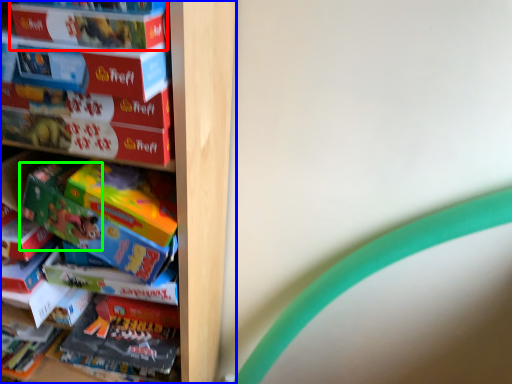
Question: Based on their relative distances, which object is nearer to paperback book (highlighted by a red box)? Choose from shelf (highlighted by a blue box) and toy (highlighted by a green box).

Choices:
 (A) shelf
 (B) toy

Answer: (B)